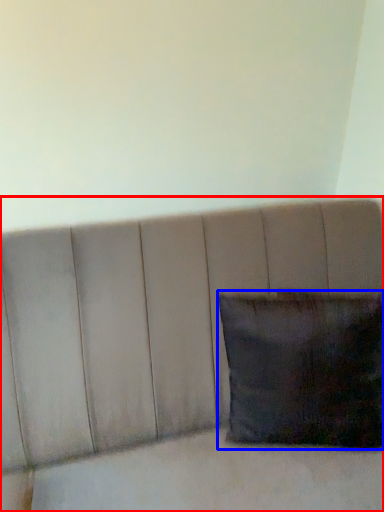
Question: Which object is further to the camera taking this photo, furniture (highlighted by a red box) or pillow (highlighted by a blue box)?

Choices:
 (A) furniture
 (B) pillow

Answer: (B)